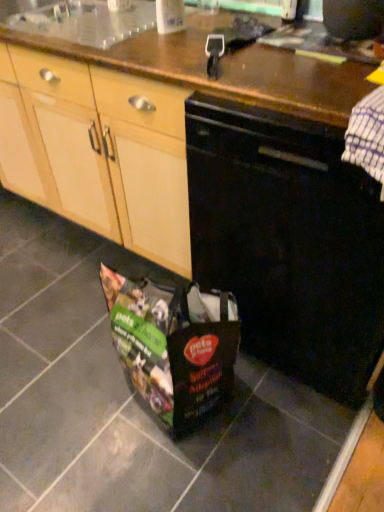
Locate an element on the screen. Image resolution: width=384 pixels, height=512 pixels. vacant space in front of white glossy container at upper center is located at coordinates (158, 48).